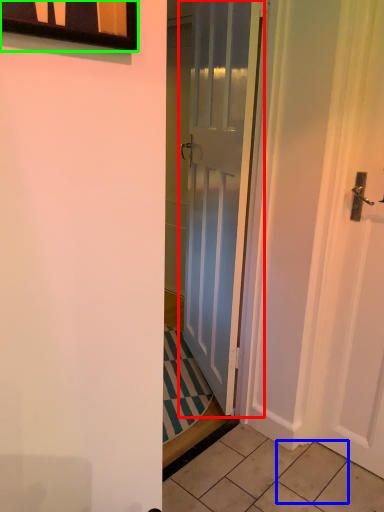
Question: Considering the real-world distances, which object is farthest from door (highlighted by a red box)? tile (highlighted by a blue box) or window (highlighted by a green box)?

Choices:
 (A) tile
 (B) window

Answer: (B)